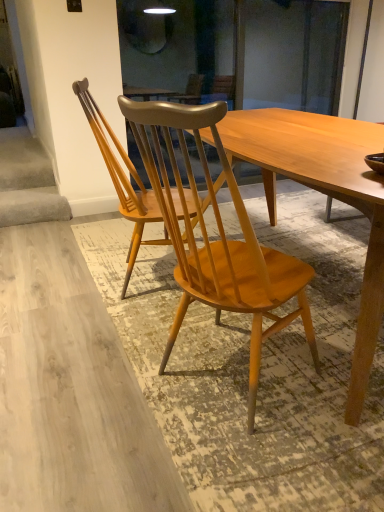
Locate an element on the screen. The image size is (384, 512). free spot to the right of natural wood chair at center, acting as the first chair starting from the front is located at coordinates (325, 380).